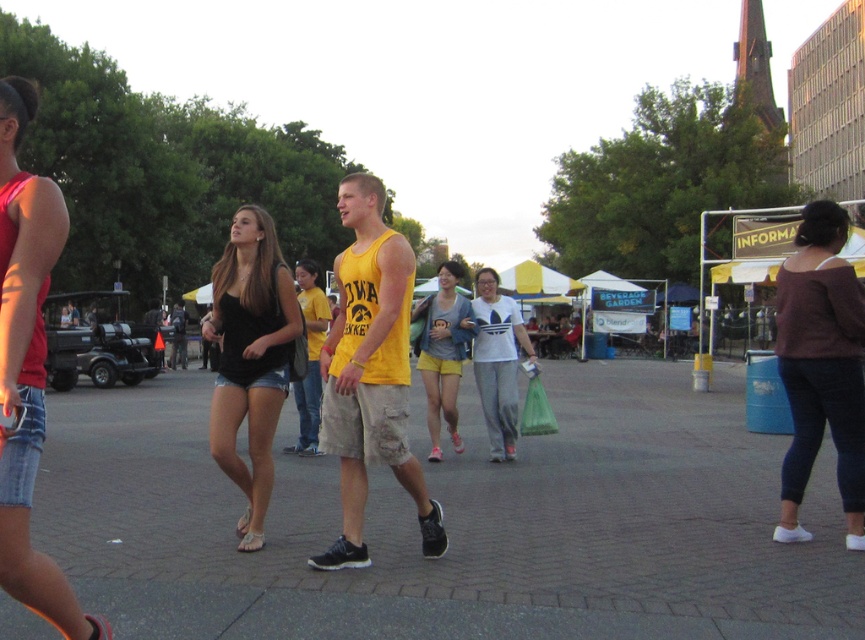
Is denim shorts at center above matte black tank top at center?

Incorrect, denim shorts at center is not positioned above matte black tank top at center.

Between denim shorts at center and matte black tank top at center, which one has less height?

Standing shorter between the two is denim shorts at center.

Which is behind, point (229, 454) or point (324, 298)?

The point (324, 298) is more distant.

Where is `denim shorts at center`? denim shorts at center is located at coordinates (250, 356).

Does yellow cotton tank top at center lie behind dark purple sweater at right?

No, yellow cotton tank top at center is in front of dark purple sweater at right.

Does yellow cotton tank top at center appear over dark purple sweater at right?

Yes.

Does point (330, 442) come farther from viewer compared to point (859, 513)?

No.

Locate an element on the screen. This screenshot has width=865, height=640. yellow cotton tank top at center is located at coordinates (370, 372).

Does white matte t-shirt at center appear under matte black tank top at center?

Yes, white matte t-shirt at center is below matte black tank top at center.

Between point (484, 381) and point (306, 422), which one is positioned behind?

The point (306, 422) is more distant.

The image size is (865, 640). What do you see at coordinates (497, 360) in the screenshot? I see `white matte t-shirt at center` at bounding box center [497, 360].

The image size is (865, 640). I want to click on white matte t-shirt at center, so click(x=497, y=360).